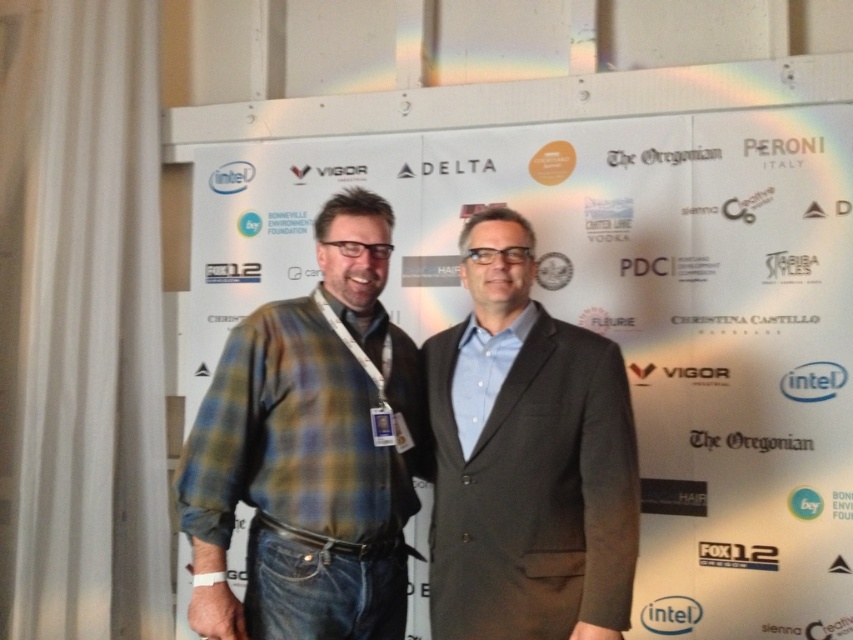
Between plaid flannel shirt at center and dark gray suit at center, which one is positioned higher?

Positioned higher is plaid flannel shirt at center.

Can you confirm if plaid flannel shirt at center is bigger than dark gray suit at center?

Correct, plaid flannel shirt at center is larger in size than dark gray suit at center.

Who is more forward, (x=289, y=512) or (x=508, y=536)?

Point (x=508, y=536) is more forward.

The width and height of the screenshot is (853, 640). I want to click on plaid flannel shirt at center, so click(310, 451).

Consider the image. Which of these two, white paper at center or dark gray suit at center, stands shorter?

dark gray suit at center is shorter.

Does white paper at center have a smaller size compared to dark gray suit at center?

Incorrect, white paper at center is not smaller in size than dark gray suit at center.

What do you see at coordinates (606, 285) in the screenshot? I see `white paper at center` at bounding box center [606, 285].

Where is `white paper at center`? white paper at center is located at coordinates (606, 285).

Consider the image. Can you confirm if white paper at center is smaller than plaid flannel shirt at center?

No.

Can you confirm if white paper at center is thinner than plaid flannel shirt at center?

No, white paper at center is not thinner than plaid flannel shirt at center.

Image resolution: width=853 pixels, height=640 pixels. I want to click on white paper at center, so coord(606,285).